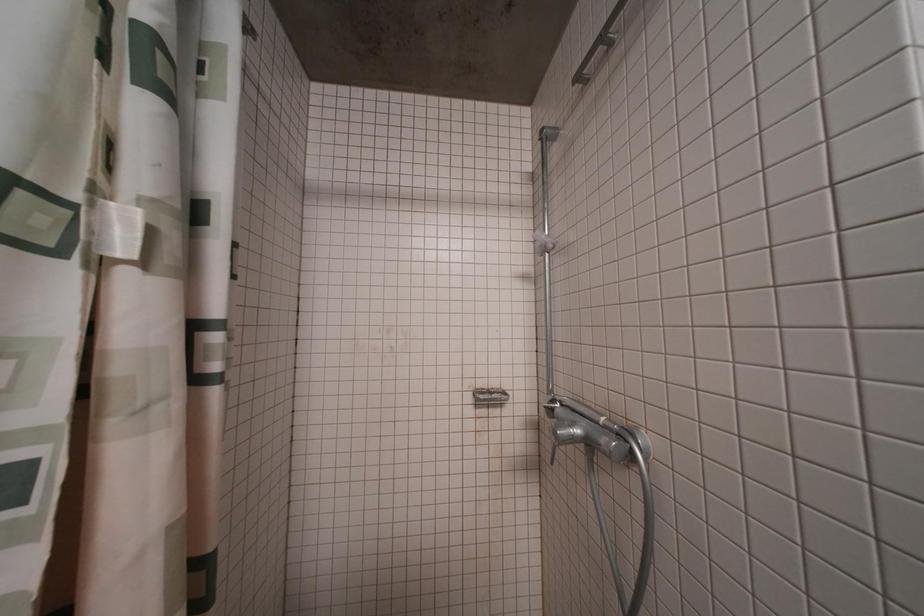
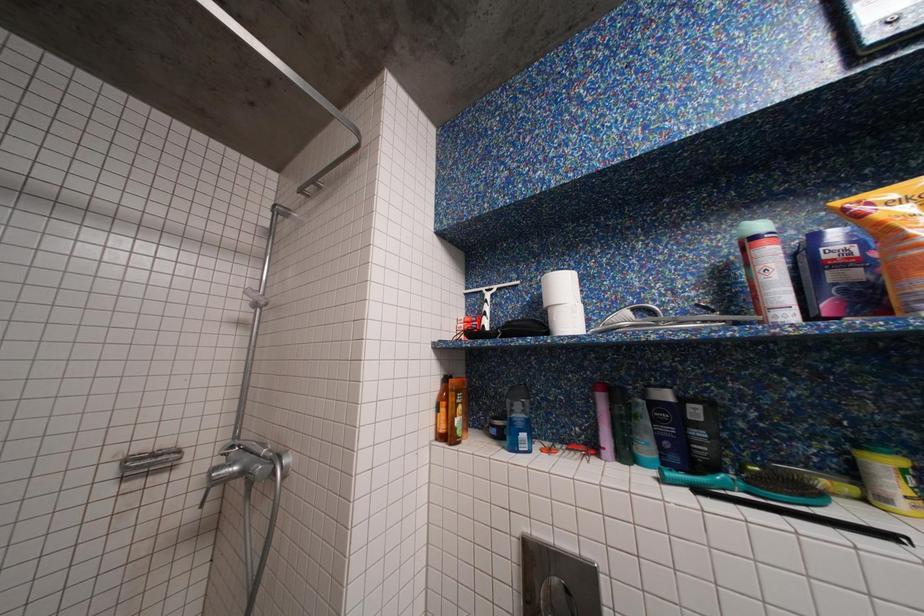
Question: The images are taken continuously from a first-person perspective. In which direction is your viewpoint rotating?

Choices:
 (A) Left
 (B) Right
 (C) Up
 (D) Down

Answer: (B)